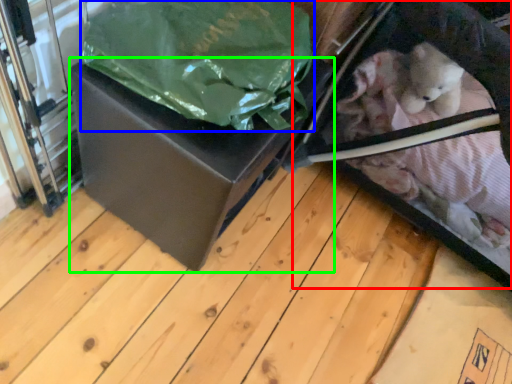
Question: Which is nearer to the baby carriage (highlighted by a red box)? plastic bag (highlighted by a blue box) or box (highlighted by a green box).

Choices:
 (A) plastic bag
 (B) box

Answer: (B)